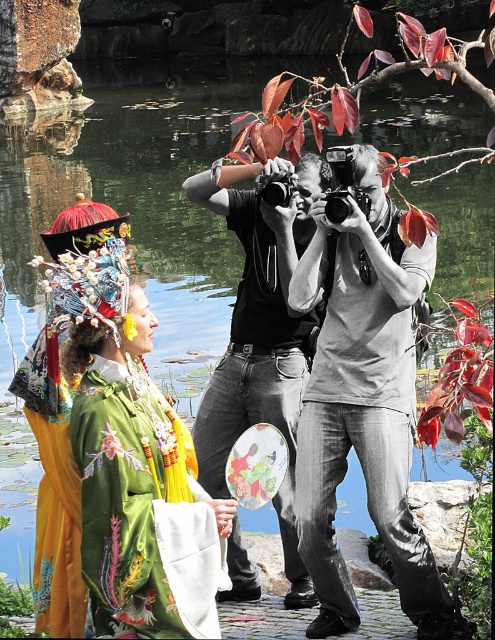
Question: Which of the following is the closest to the observer?

Choices:
 (A) [x=403, y=563]
 (B) [x=161, y=560]

Answer: (B)

Question: Which point appears farthest from the camera in this image?

Choices:
 (A) (217, 195)
 (B) (119, 442)

Answer: (A)

Question: Which point is farther to the camera?

Choices:
 (A) (362, 241)
 (B) (144, 412)

Answer: (A)

Question: Does green satin robe at center have a smaller size compared to matte black camera at center?

Choices:
 (A) yes
 (B) no

Answer: (B)

Question: Can you confirm if green satin robe at center is positioned above matte black camera at center?

Choices:
 (A) yes
 (B) no

Answer: (B)

Question: Can you confirm if gray cotton t-shirt at center is positioned to the right of matte black camera at center?

Choices:
 (A) yes
 (B) no

Answer: (A)